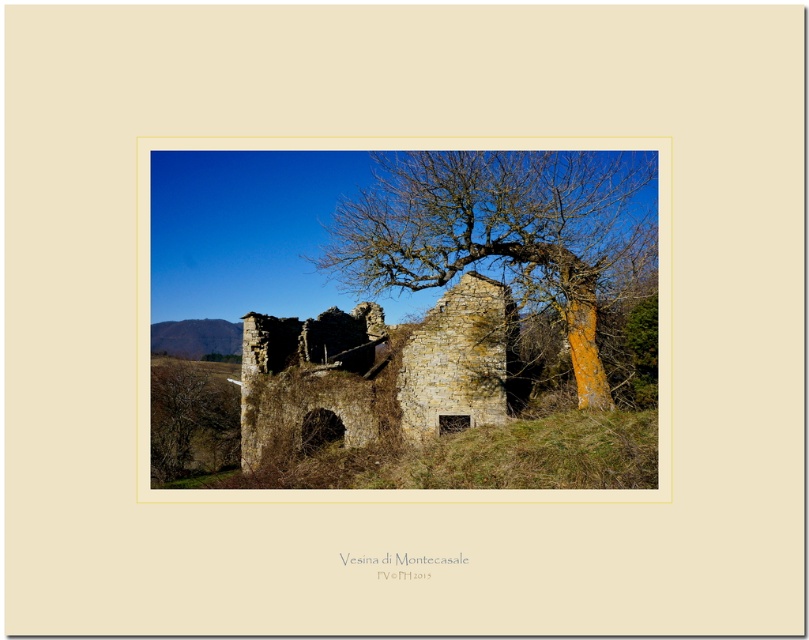
Question: Does yellowish-green mossy stone at center appear on the left side of brown rough bark tree at lower left?

Choices:
 (A) yes
 (B) no

Answer: (B)

Question: Is stone ruins at center above brown rough bark tree at lower left?

Choices:
 (A) no
 (B) yes

Answer: (B)

Question: Is yellowish-green mossy stone at center thinner than brown rough bark tree at lower left?

Choices:
 (A) yes
 (B) no

Answer: (B)

Question: Which point is farther to the camera?

Choices:
 (A) (x=570, y=355)
 (B) (x=202, y=451)

Answer: (B)

Question: Which of the following is the farthest from the observer?

Choices:
 (A) (197, 456)
 (B) (579, 170)

Answer: (A)

Question: Among these points, which one is nearest to the camera?

Choices:
 (A) (371, 397)
 (B) (337, 268)

Answer: (A)